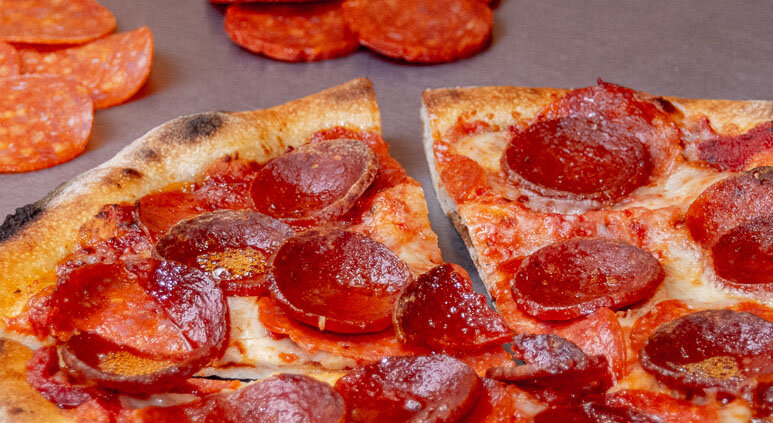
Find the location of a particular element. pepperoni on table is located at coordinates (56, 20), (5, 62), (87, 59), (39, 111), (288, 33), (407, 23).